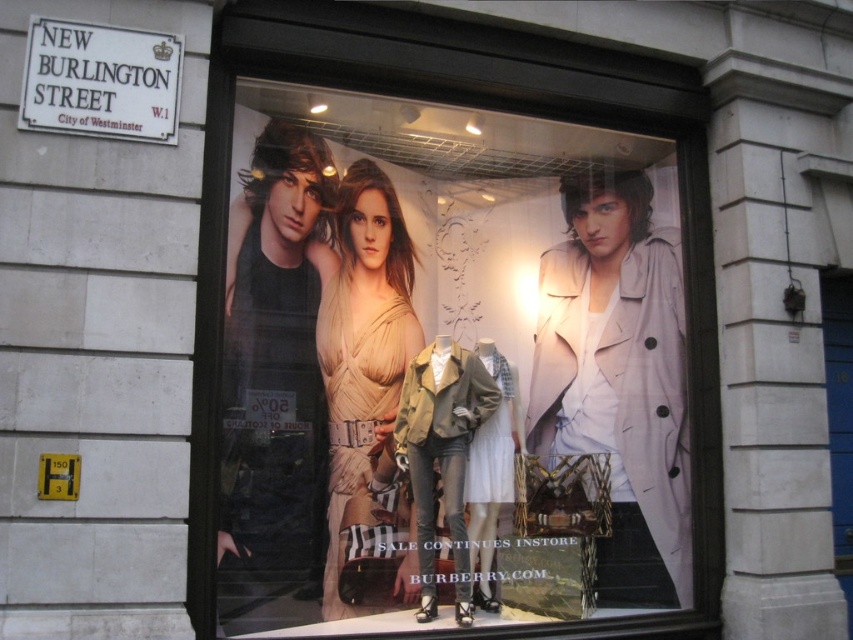
This screenshot has width=853, height=640. Describe the element at coordinates (367, 385) in the screenshot. I see `matte beige dress at center` at that location.

Which of these two, matte beige dress at center or white stone street sign at upper left, stands taller?

matte beige dress at center is taller.

This screenshot has height=640, width=853. What are the coordinates of `matte beige dress at center` in the screenshot? It's located at (367, 385).